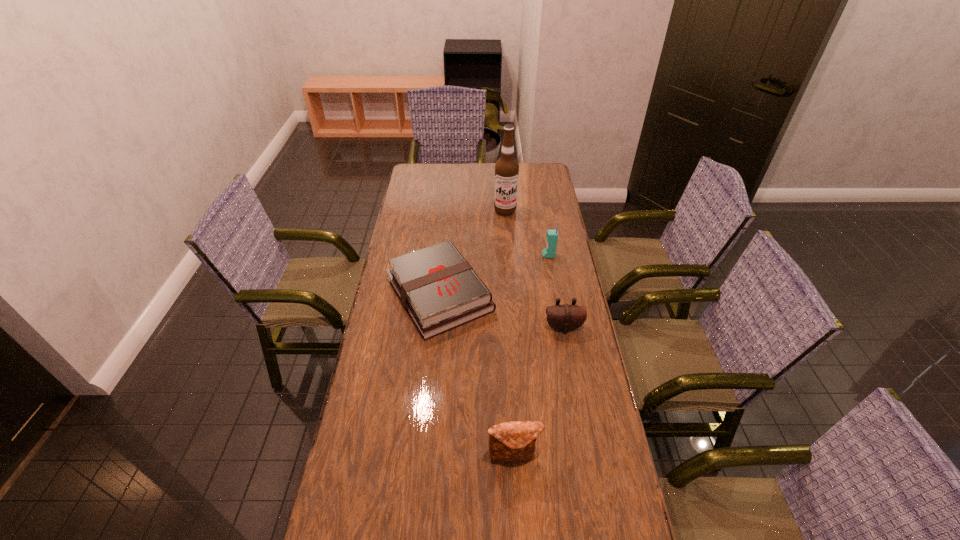
This screenshot has width=960, height=540. I want to click on the farthest object, so click(506, 168).

This screenshot has height=540, width=960. What are the coordinates of `the tallest object` in the screenshot? It's located at (506, 168).

Locate an element on the screen. The height and width of the screenshot is (540, 960). cellular telephone is located at coordinates (552, 235).

Locate an element on the screen. This screenshot has width=960, height=540. clutch bag is located at coordinates (512, 441).

Where is `the fourth tallest object`? Image resolution: width=960 pixels, height=540 pixels. the fourth tallest object is located at coordinates click(x=564, y=318).

Where is `the shortest object`? The image size is (960, 540). the shortest object is located at coordinates (438, 288).

Find the location of `vacant region located on the label of the alcohol`. vacant region located on the label of the alcohol is located at coordinates (509, 267).

I want to click on vacant space located on the keypad of the cellular telephone, so click(x=513, y=255).

Identify the location of vacant area situated on the keypad of the cellular telephone. Image resolution: width=960 pixels, height=540 pixels. (520, 255).

Find the location of `free space located on the keypad of the cellular telephone`. free space located on the keypad of the cellular telephone is located at coordinates (518, 255).